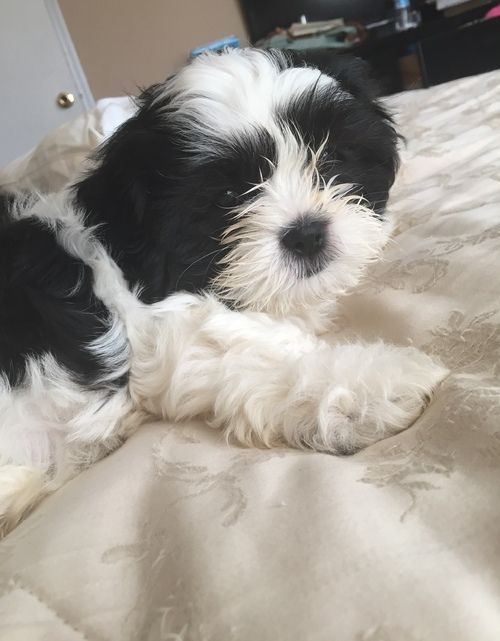
Locate an element on the screen. door is located at coordinates (43, 69).